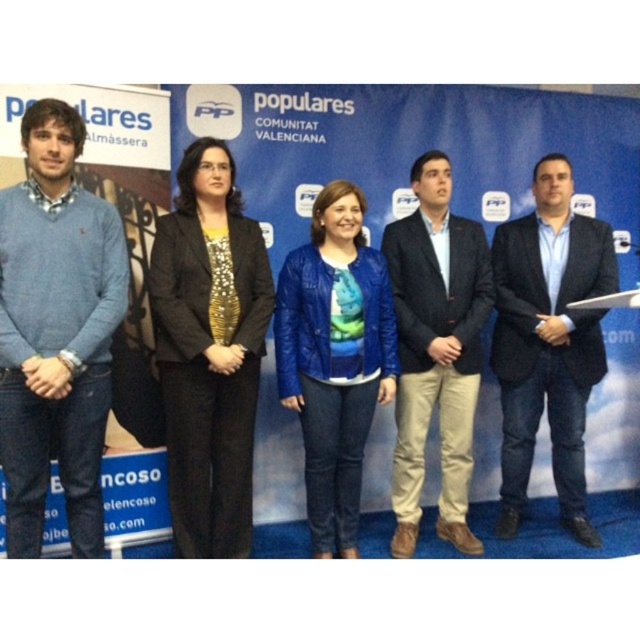
Can you confirm if blue leather jacket at center is bigger than dark brown leather jacket at center?

No, blue leather jacket at center is not bigger than dark brown leather jacket at center.

Which of these two, blue leather jacket at center or dark brown leather jacket at center, stands shorter?

Standing shorter between the two is blue leather jacket at center.

From the picture: Who is more distant from viewer, (326, 330) or (448, 467)?

The point (448, 467) is behind.

What are the coordinates of `blue leather jacket at center` in the screenshot? It's located at (333, 358).

Does black sequined blazer at center appear over blue denim jeans at center?

Actually, black sequined blazer at center is below blue denim jeans at center.

Is point (252, 394) positioned after point (584, 531)?

No.

Is point (230, 348) less distant than point (493, 275)?

Yes, point (230, 348) is closer to viewer.

The height and width of the screenshot is (640, 640). In order to click on black sequined blazer at center in this screenshot , I will do `click(209, 349)`.

Locate an element on the screen. Image resolution: width=640 pixels, height=640 pixels. matte blue sweater at left is located at coordinates (54, 332).

The height and width of the screenshot is (640, 640). What do you see at coordinates (54, 332) in the screenshot?
I see `matte blue sweater at left` at bounding box center [54, 332].

You are a GUI agent. You are given a task and a screenshot of the screen. Output one action in this format:
    pyautogui.click(x=<x>, y=<y>)
    Task: Click on the matte blue sweater at left
    The image size is (640, 640).
    Given the screenshot: What is the action you would take?
    pyautogui.click(x=54, y=332)